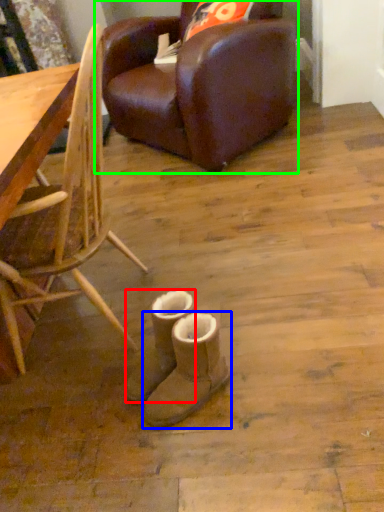
Question: Which object is the farthest from footwear (highlighted by a red box)? Choose among these: footwear (highlighted by a blue box) or chair (highlighted by a green box).

Choices:
 (A) footwear
 (B) chair

Answer: (B)